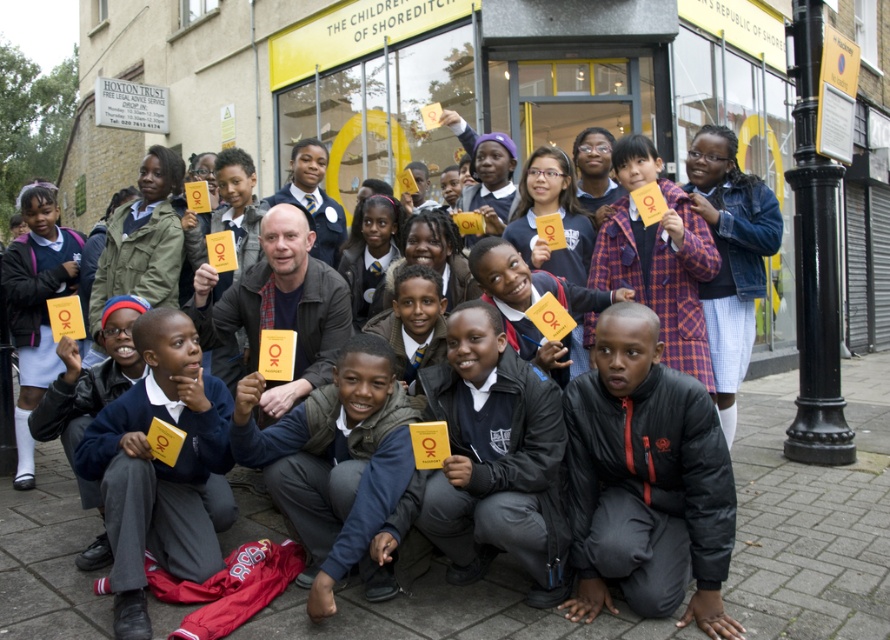
Question: Does black matte jacket at lower center have a smaller size compared to matte blue uniform at lower left?

Choices:
 (A) yes
 (B) no

Answer: (A)

Question: Can you confirm if matte blue uniform at lower left is thinner than matte yellow card at center?

Choices:
 (A) yes
 (B) no

Answer: (A)

Question: Which of the following is the farthest from the observer?

Choices:
 (A) matte blue uniform at lower left
 (B) matte yellow card at center
 (C) black matte jacket at lower center

Answer: (B)

Question: Does black matte jacket at lower center appear over matte blue uniform at lower left?

Choices:
 (A) no
 (B) yes

Answer: (B)

Question: Which of these objects is positioned farthest from the matte yellow card at center?

Choices:
 (A) matte blue uniform at lower left
 (B) black matte jacket at lower center

Answer: (B)

Question: Which point is closer to the camera?

Choices:
 (A) (385, 438)
 (B) (111, 456)

Answer: (B)